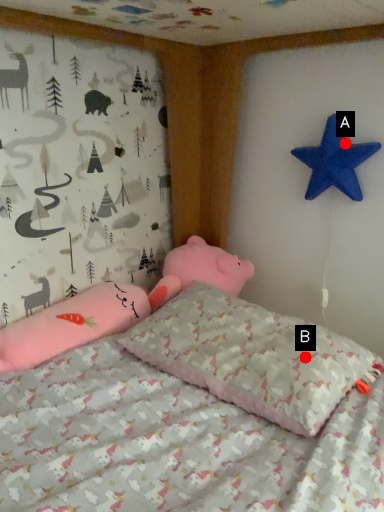
Question: Two points are circled on the image, labeled by A and B beside each circle. Among these points, which one is nearest to the camera?

Choices:
 (A) A is closer
 (B) B is closer

Answer: (B)